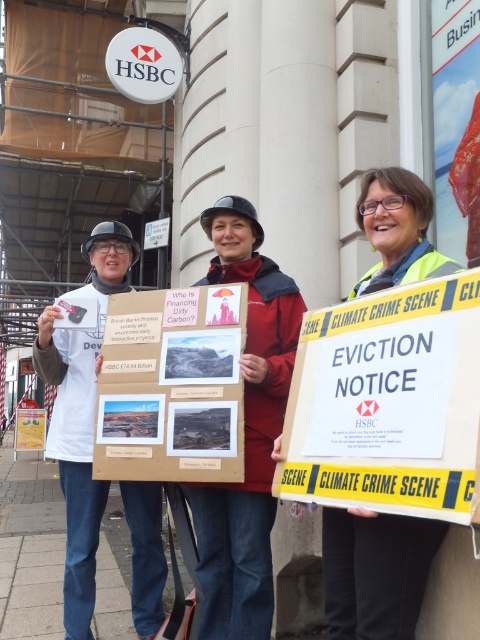
Question: Is white paperboard at left bigger than yellow reflective vest at center?

Choices:
 (A) no
 (B) yes

Answer: (B)

Question: Estimate the real-world distances between objects in this image. Which object is closer to the yellow reflective vest at center?

Choices:
 (A) wooden board at center
 (B) white paperboard at left
 (C) red fabric coat at center

Answer: (C)

Question: Which point is farther to the camera?

Choices:
 (A) (64, 467)
 (B) (290, 349)
 (C) (37, 429)

Answer: (C)

Question: Which object is positioned closest to the red fabric coat at center?

Choices:
 (A) white paperboard at left
 (B) yellow reflective vest at center
 (C) wooden board at center

Answer: (A)

Question: Is yellow reflective vest at center smaller than wooden board at center?

Choices:
 (A) no
 (B) yes

Answer: (B)

Question: Is red fabric coat at center in front of wooden board at center?

Choices:
 (A) no
 (B) yes

Answer: (B)